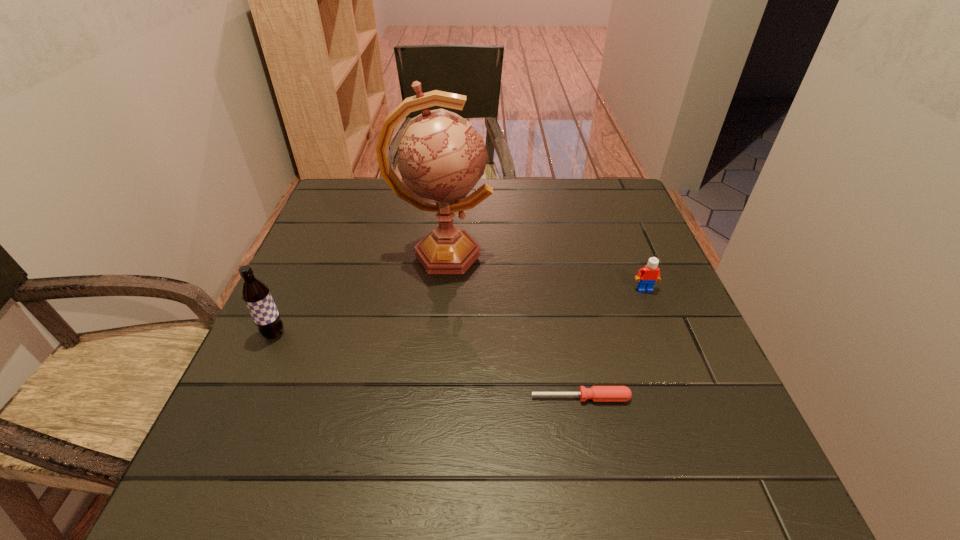
The width and height of the screenshot is (960, 540). Identify the location of vacant space located on the face of the rightmost object. (678, 372).

Locate an element on the screen. free region located on the back of the third object from left to right is located at coordinates pos(565,320).

Locate an element on the screen. object that is at the left edge is located at coordinates (256, 295).

Where is `object present at the right edge`? object present at the right edge is located at coordinates (650, 273).

In the image, there is a desktop. Find the location of `vacant space at the far edge`. vacant space at the far edge is located at coordinates (545, 203).

Where is `vacant area at the near edge`? The height and width of the screenshot is (540, 960). vacant area at the near edge is located at coordinates (470, 502).

The width and height of the screenshot is (960, 540). I want to click on free space at the left edge of the desktop, so click(334, 278).

I want to click on blank space at the right edge of the desktop, so click(x=706, y=363).

The height and width of the screenshot is (540, 960). Identify the location of vacant space at the far left corner. pyautogui.click(x=378, y=204).

Locate an element on the screen. The width and height of the screenshot is (960, 540). free spot at the near left corner of the desktop is located at coordinates (232, 482).